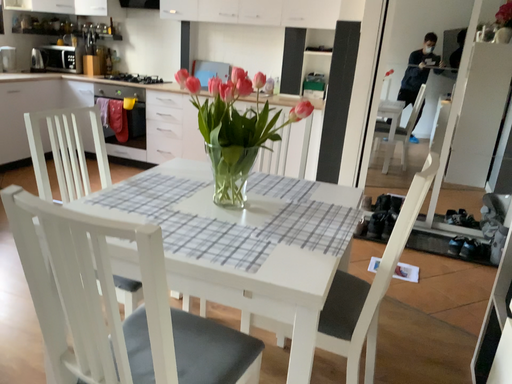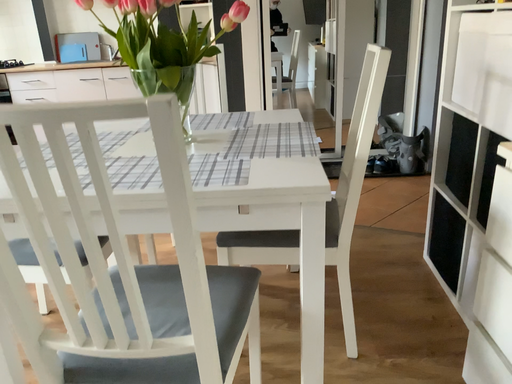
Question: How did the camera likely rotate when shooting the video?

Choices:
 (A) rotated right
 (B) rotated left

Answer: (A)